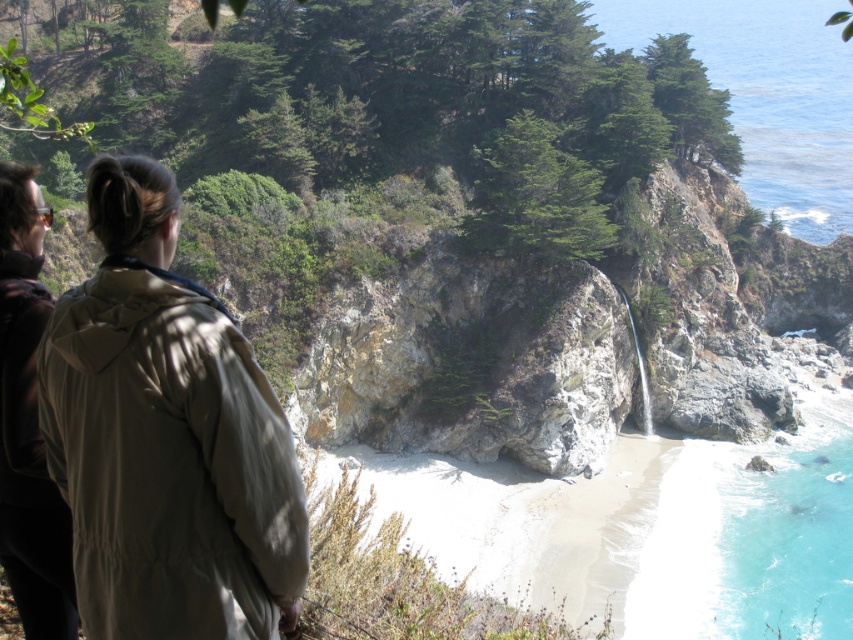
Question: Does beige fabric jacket at left appear under turquoise liquid at lower right?

Choices:
 (A) no
 (B) yes

Answer: (A)

Question: Does beige fabric jacket at left appear under turquoise liquid at lower right?

Choices:
 (A) yes
 (B) no

Answer: (B)

Question: Which point is farther to the camera?

Choices:
 (A) dark brown leather jacket at left
 (B) beige fabric jacket at left

Answer: (A)

Question: Which point appears closest to the camera in this image?

Choices:
 (A) (51, 486)
 (B) (715, 536)
 (C) (235, 449)

Answer: (C)

Question: Is beige fabric jacket at left positioned at the back of turquoise liquid at lower right?

Choices:
 (A) yes
 (B) no

Answer: (B)

Question: Which point is closer to the camera?

Choices:
 (A) (55, 627)
 (B) (131, 356)

Answer: (B)